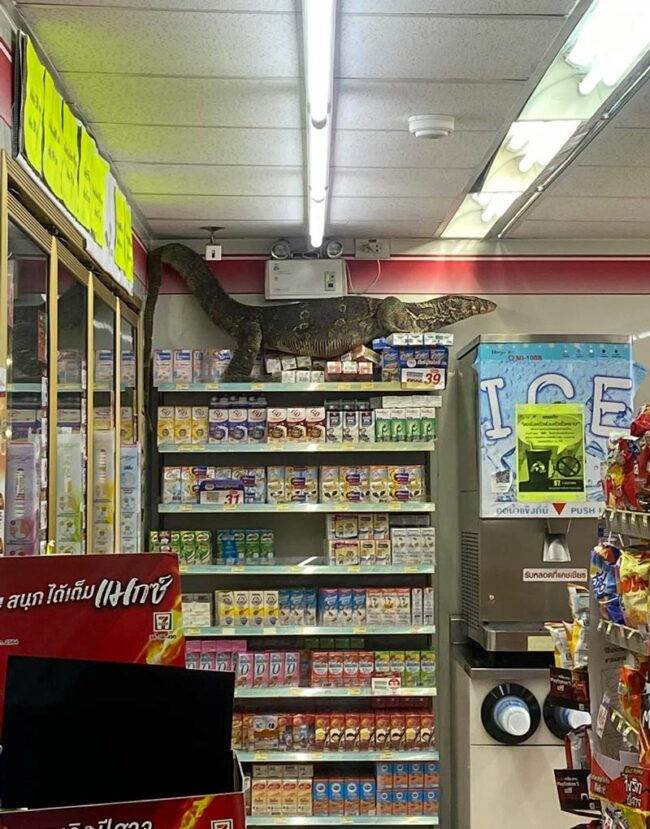
The width and height of the screenshot is (650, 829). Find the location of `gold door frame`. gold door frame is located at coordinates (36, 235), (52, 311), (82, 269), (91, 438), (118, 417), (133, 309), (25, 181), (5, 215).